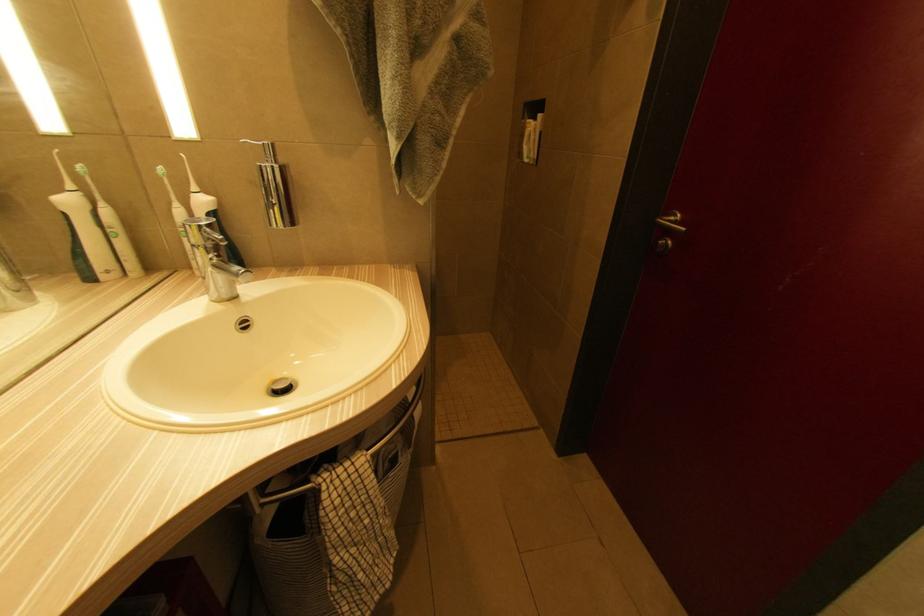
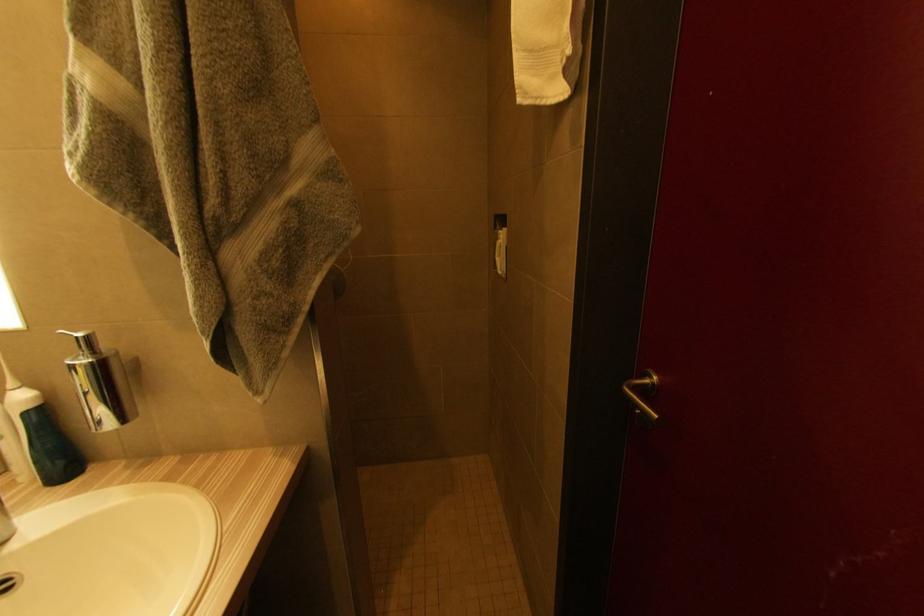
The images are taken continuously from a first-person perspective. In which direction are you moving?

The cameraman walked toward right, forward.